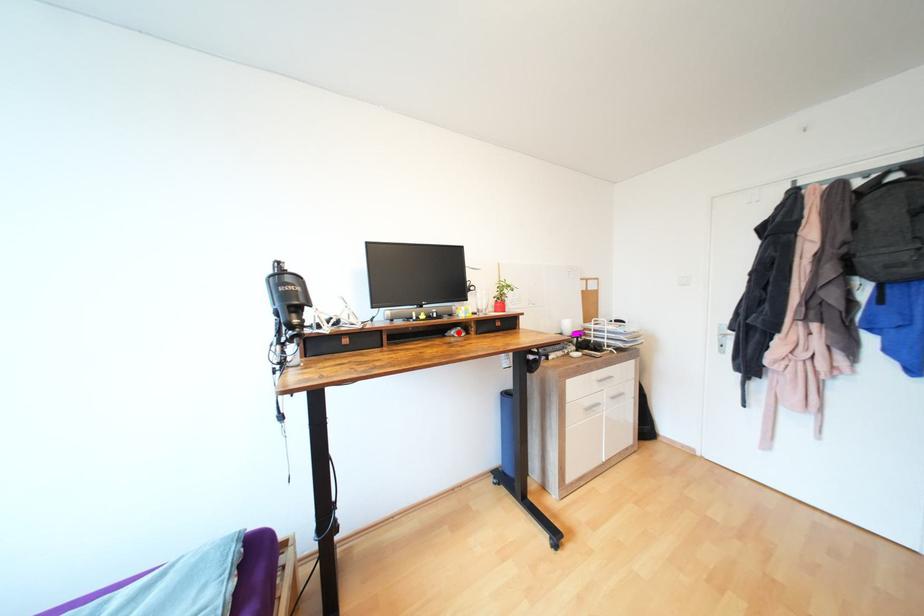
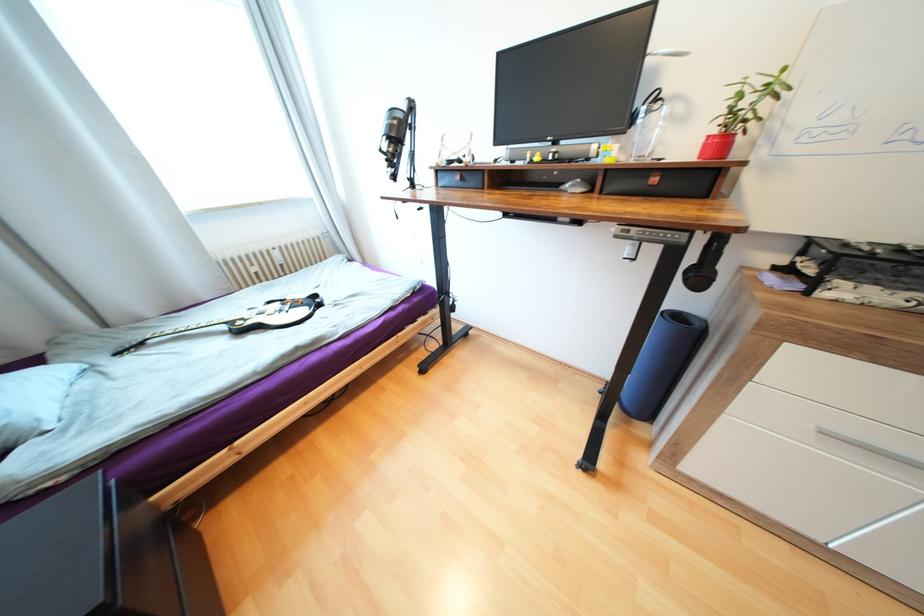
Question: A red point is marked in image1. In image2, is the corresponding 3D point closer to the camera or farther? Reply with the corresponding letter.

Choices:
 (A) The corresponding 3D point is closer.
 (B) The corresponding 3D point is farther.

Answer: (A)